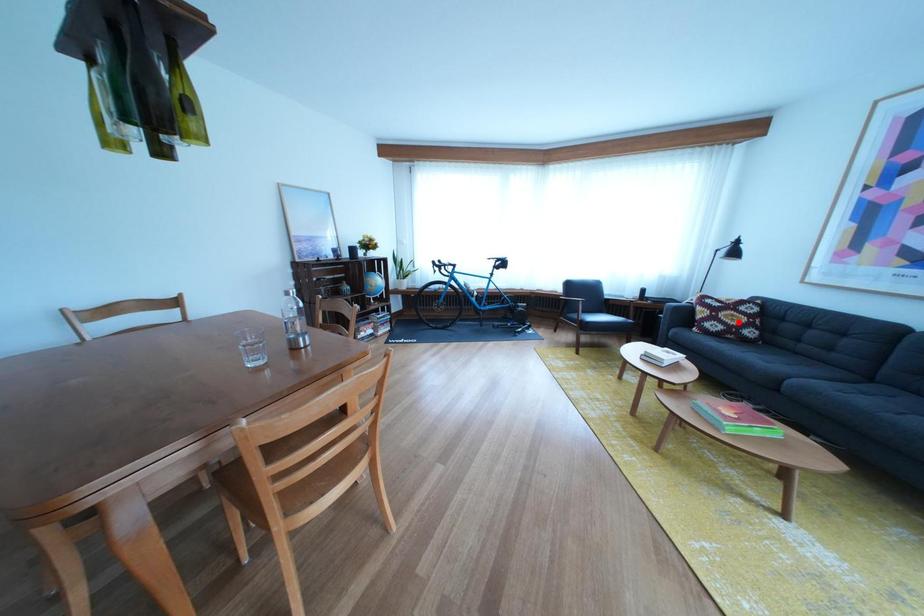
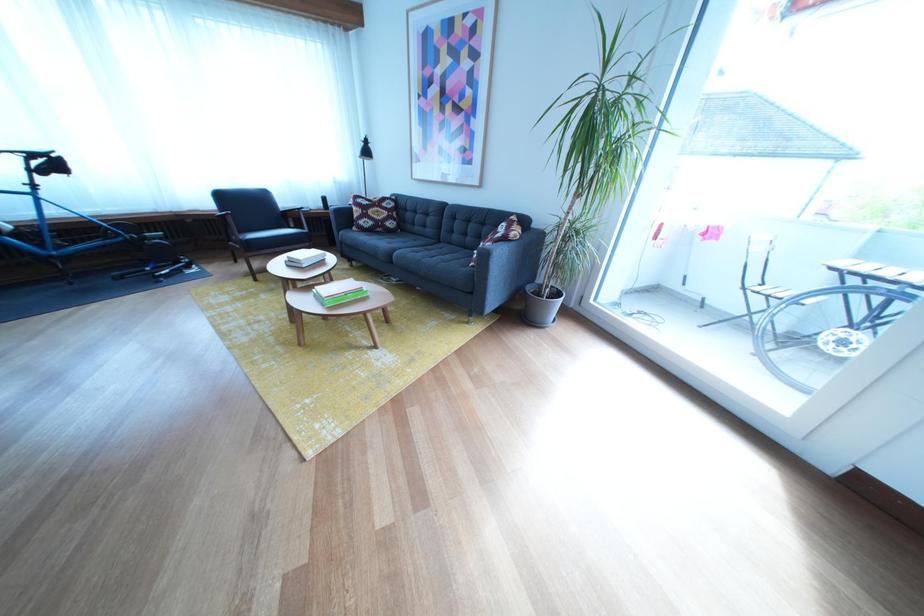
Question: I am providing you with two images of the same scene from different viewpoints. In image1, a red point is highlighted. Considering the same 3D point in image2, which of the following is correct?

Choices:
 (A) It is closer
 (B) It is farther

Answer: (A)